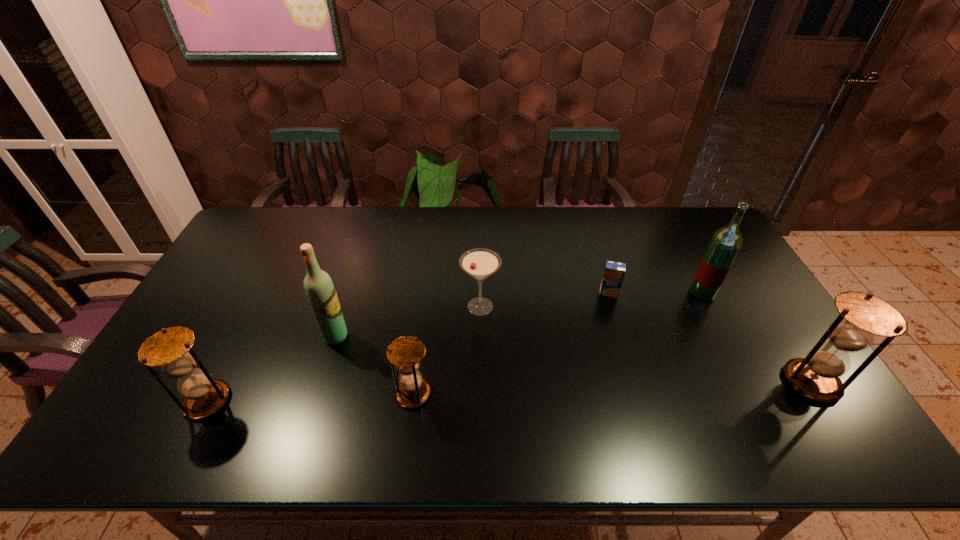
Image resolution: width=960 pixels, height=540 pixels. Find the location of `the second object from right to left`. the second object from right to left is located at coordinates 725,243.

This screenshot has width=960, height=540. In order to click on martini in this screenshot , I will do `click(480, 263)`.

Identify the location of vacant region located 0.260m on the right of the second shortest hourglass. Image resolution: width=960 pixels, height=540 pixels. (335, 401).

This screenshot has width=960, height=540. What are the coordinates of `free location located on the right of the fifth object from right to left` in the screenshot? It's located at (528, 394).

The image size is (960, 540). In order to click on free space located 0.250m on the left of the third tallest object in this screenshot , I will do `click(687, 382)`.

Locate an element on the screen. vacant space located on the front of the shortest object is located at coordinates (643, 407).

The height and width of the screenshot is (540, 960). I want to click on vacant space located 0.340m on the front-facing side of the wine bottle, so click(469, 336).

Where is `vacant space located on the back of the second object from right to left`? vacant space located on the back of the second object from right to left is located at coordinates (667, 226).

Image resolution: width=960 pixels, height=540 pixels. Identify the location of free point located on the right of the martini. (519, 307).

This screenshot has height=540, width=960. I want to click on object that is at the left edge, so click(x=170, y=348).